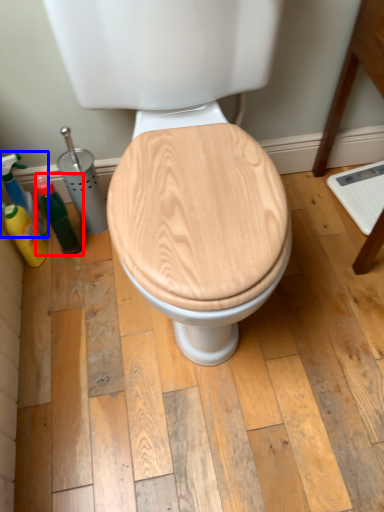
Question: Among these objects, which one is nearest to the camera, bottle (highlighted by a red box) or cleaning product (highlighted by a blue box)?

Choices:
 (A) bottle
 (B) cleaning product

Answer: (A)